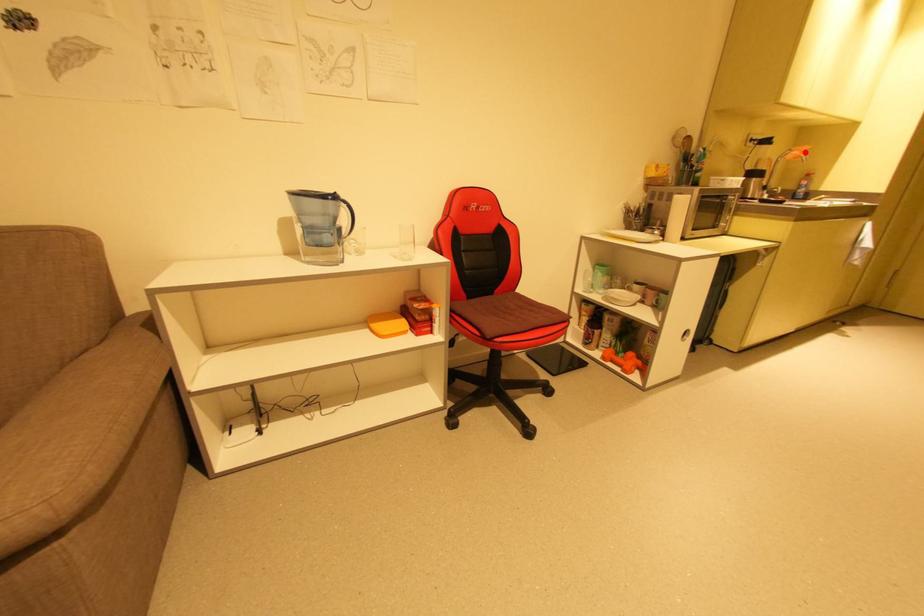
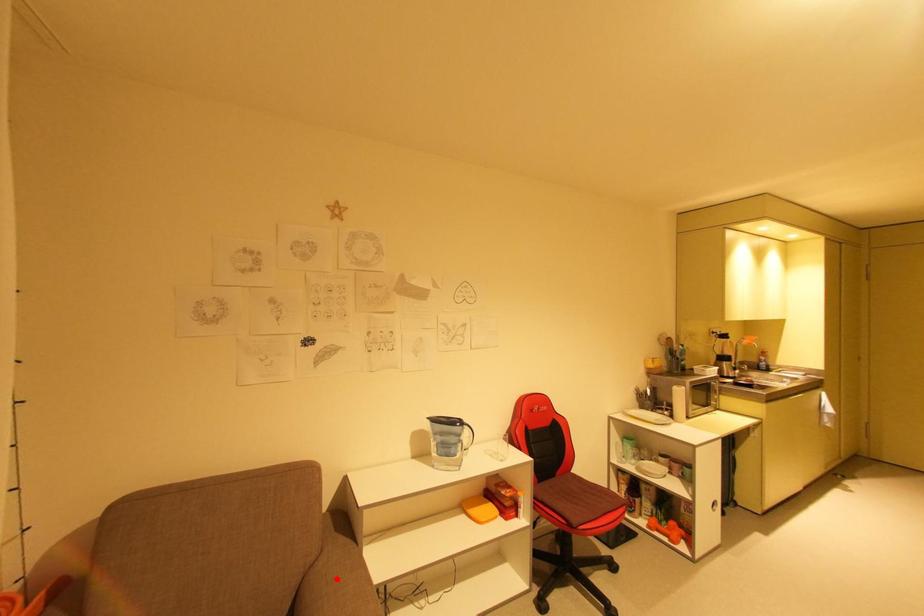
I am providing you with two images of the same scene from different viewpoints. A red point is marked on the first image and another point is marked on the second image. Does the point marked in image1 correspond to the same location as the one in image2?

No